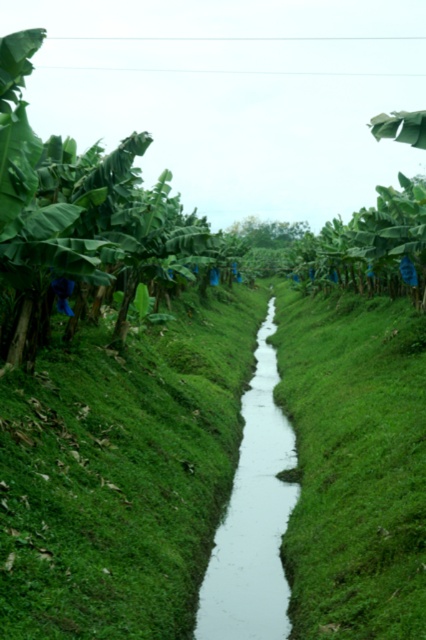
You are a farmer checking the irrigation system. You notice the green grass at center and the white smooth stream at center. Which one is taller?

The green grass at center is much taller than the white smooth stream at center.

You are a farmer walking along the canal in the banana plantation. You need to reach the green leafy banana tree at left from the white smooth stream at center. Which direction should you move relative to the stream?

The green leafy banana tree at left is located above the white smooth stream at center, so you should move upward from the stream to reach it.